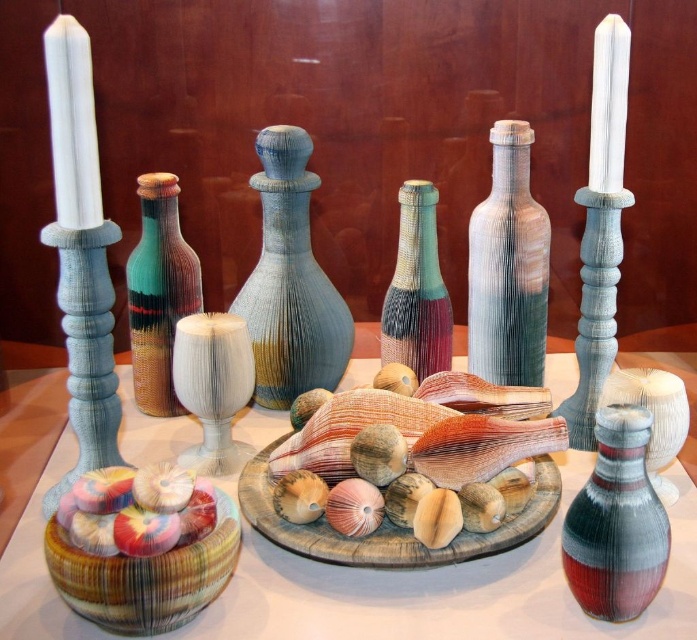
The width and height of the screenshot is (697, 640). What do you see at coordinates (392, 524) in the screenshot? I see `textured wood platter at center` at bounding box center [392, 524].

Is the position of textured wood platter at center less distant than that of multicolored woven vase at center?

Yes, it is.

Does point (355, 554) come behind point (185, 312)?

No.

This screenshot has height=640, width=697. What are the coordinates of `textured wood platter at center` in the screenshot? It's located at (392, 524).

Between multicolored woven vase at center and white textured candle holder at center, which one has less height?

white textured candle holder at center is shorter.

Does multicolored woven vase at center have a greater height compared to white textured candle holder at center?

Yes, multicolored woven vase at center is taller than white textured candle holder at center.

The width and height of the screenshot is (697, 640). What are the coordinates of `multicolored woven vase at center` in the screenshot? It's located at (158, 292).

Is striped fabric vase at center smaller than textured wood platter at center?

Yes, striped fabric vase at center is smaller than textured wood platter at center.

Between striped fabric vase at center and textured wood platter at center, which one appears on the left side from the viewer's perspective?

textured wood platter at center

Between point (631, 534) and point (464, 536), which one is positioned in front?

Point (631, 534) is in front.

Where is `striped fabric vase at center`? striped fabric vase at center is located at coordinates 615,522.